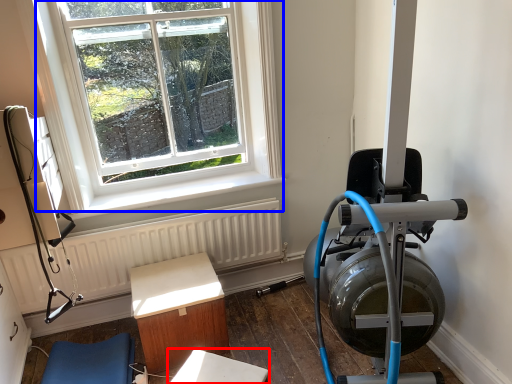
Question: Which object appears farthest to the camera in this image, table (highlighted by a red box) or window (highlighted by a blue box)?

Choices:
 (A) table
 (B) window

Answer: (B)